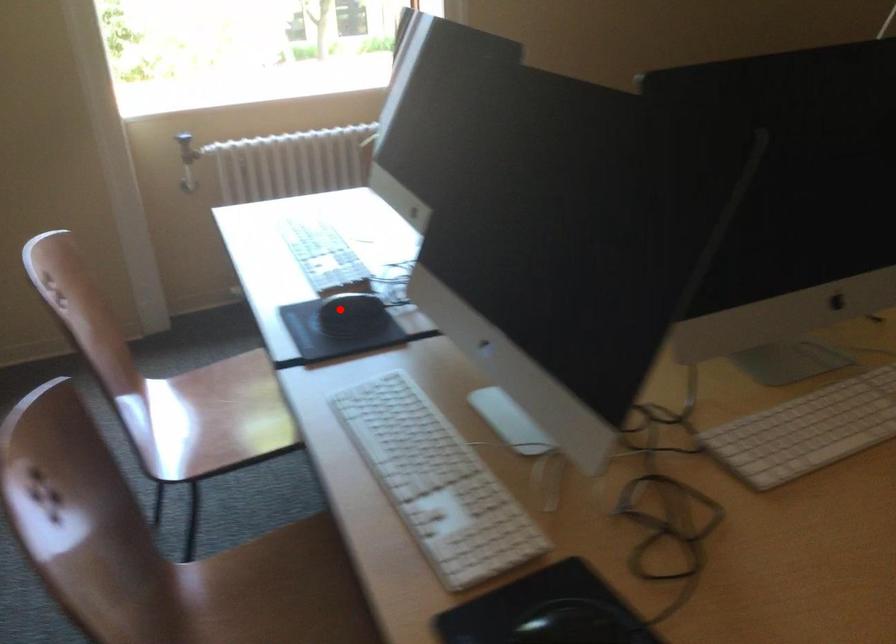
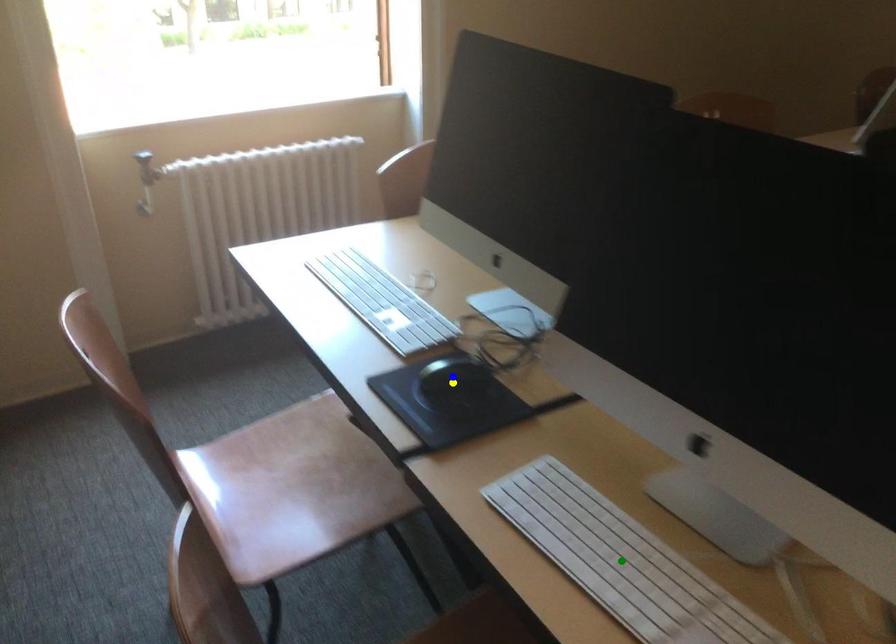
Question: I am providing you with two images of the same scene from different viewpoints. A red point is marked on the first image. You are given multiple points on the second image. Can you choose the point in image 2 that corresponds to the point in image 1?

Choices:
 (A) green point
 (B) yellow point
 (C) blue point

Answer: (B)